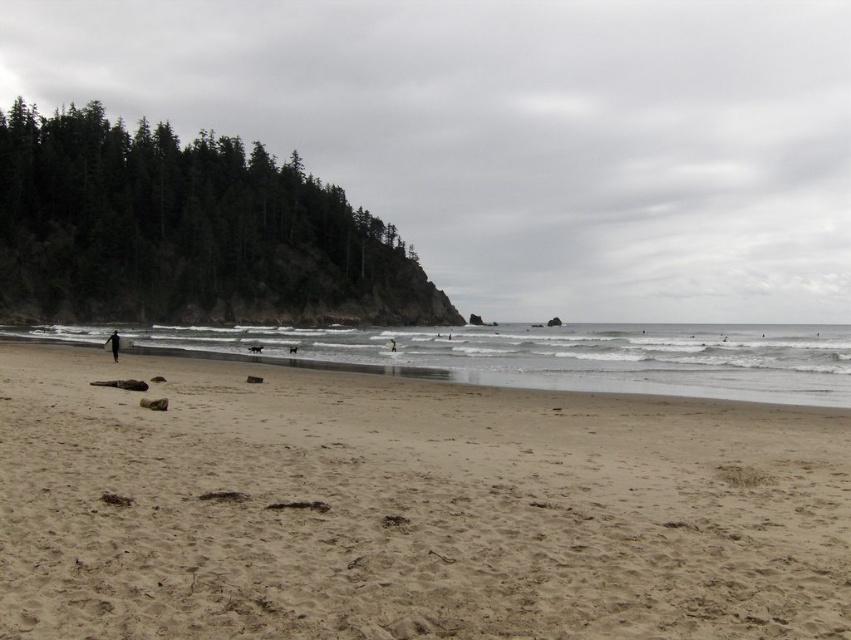
You are standing at the point marked as point (118, 348) on the beach. The nearest lifeguard station is located 60 meters away from your current position. Can you safely reach it without getting your feet wet?

The distance between you and the viewer is 55.94 meters, which is less than the 60 meters to the lifeguard station. Since the point (118, 348) is on the beach, you can safely walk to the lifeguard station without getting your feet wet.